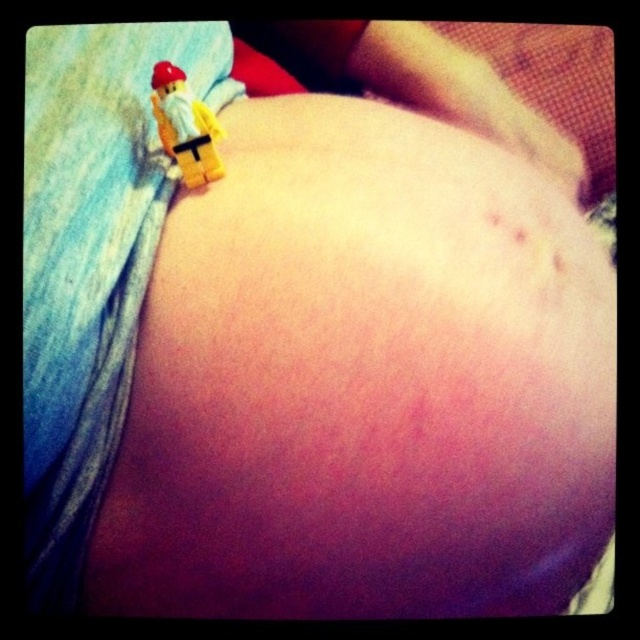
You are a photographer trying to capture a close up of the bruise on the person. You are currently standing at the camera position. The bruise is located at point (x=413, y=28). If you want to zoom in on the bruise without moving the camera, what should you do?

You should adjust the camera settings to zoom in on the bruise located at point (x=413, y=28) since the distance between the point and the camera is 24.04 inches, which allows for a close up without moving the camera position.

You are a medical professional examining the image. You notice the smooth skin at upper center and the yellow plastic minifigure at upper left. Which object occupies more vertical space in the image?

The smooth skin at upper center has a greater height compared to the yellow plastic minifigure at upper left, so it occupies more vertical space.

You are a medical professional examining the bruise on the person. You notice a point at coordinates (419, 81). Based on the skin texture at this point, is the area more likely to be part of the bruise or healthy skin?

The point at coordinates (419, 81) indicates smooth skin at upper center, so it is more likely to be healthy skin rather than part of the bruise.